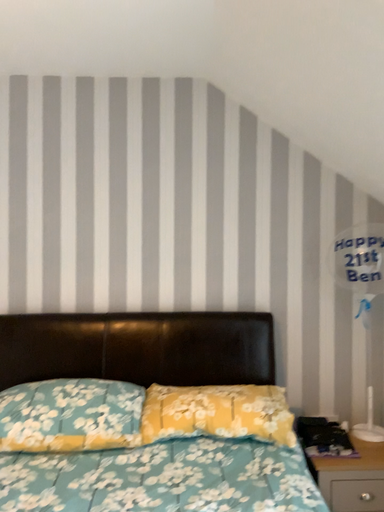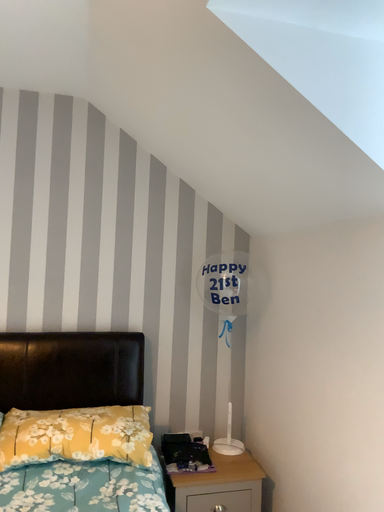
Question: Which way did the camera rotate in the video?

Choices:
 (A) rotated left
 (B) rotated right

Answer: (B)